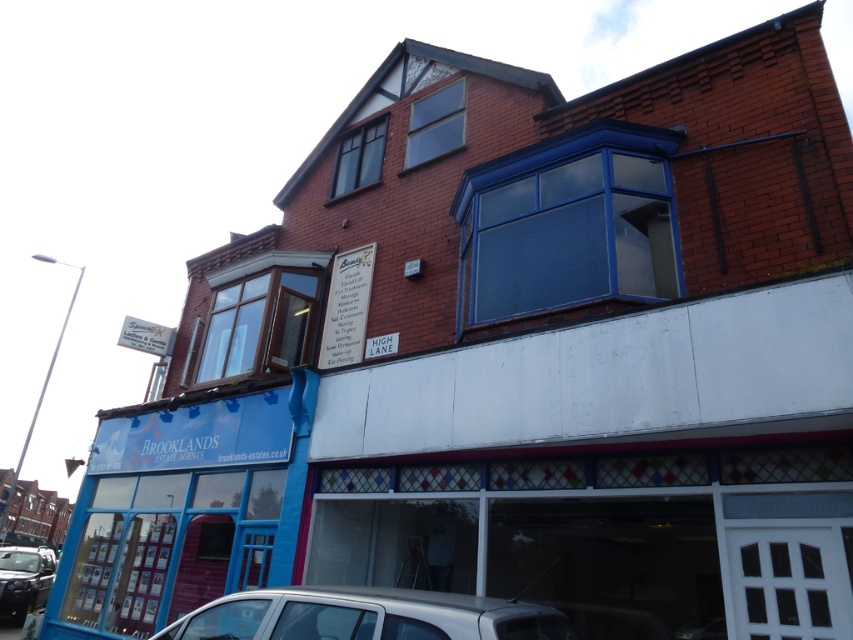
You are standing at the entrance of Brooklands Estate Agents. You need to park your car in the nearest available spot. According to the image, where is the silver metallic car at lower center located?

The silver metallic car at lower center is located at point [364,616].